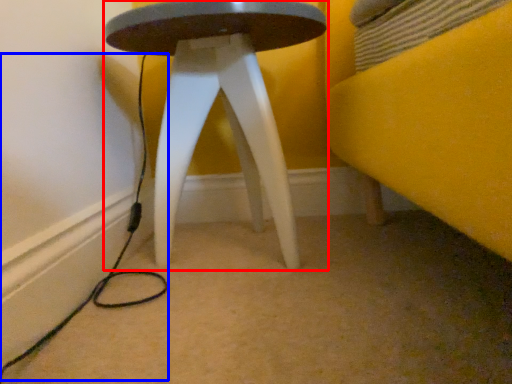
Question: Among these objects, which one is farthest to the camera, stool (highlighted by a red box) or cable (highlighted by a blue box)?

Choices:
 (A) stool
 (B) cable

Answer: (A)